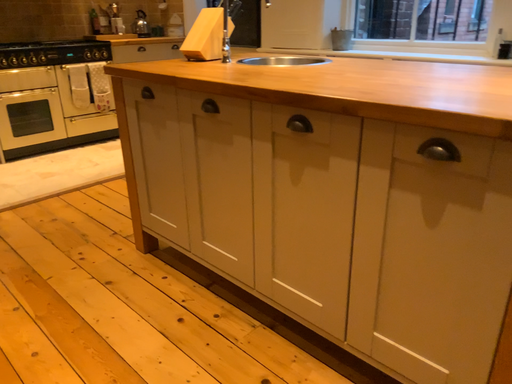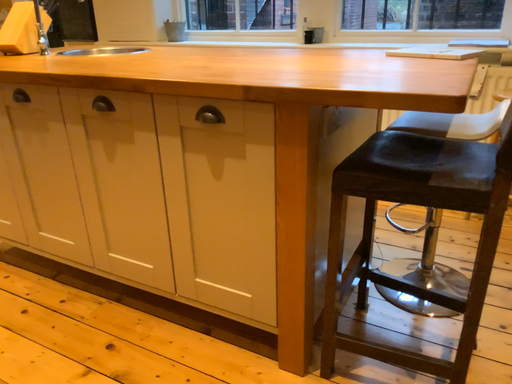
Question: How did the camera likely rotate when shooting the video?

Choices:
 (A) rotated left
 (B) rotated right

Answer: (B)